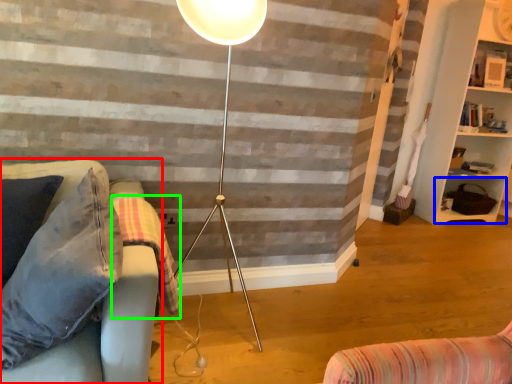
Question: Considering the real-world distances, which object is farthest from studio couch (highlighted by a red box)? shelf (highlighted by a blue box) or blanket (highlighted by a green box)?

Choices:
 (A) shelf
 (B) blanket

Answer: (A)